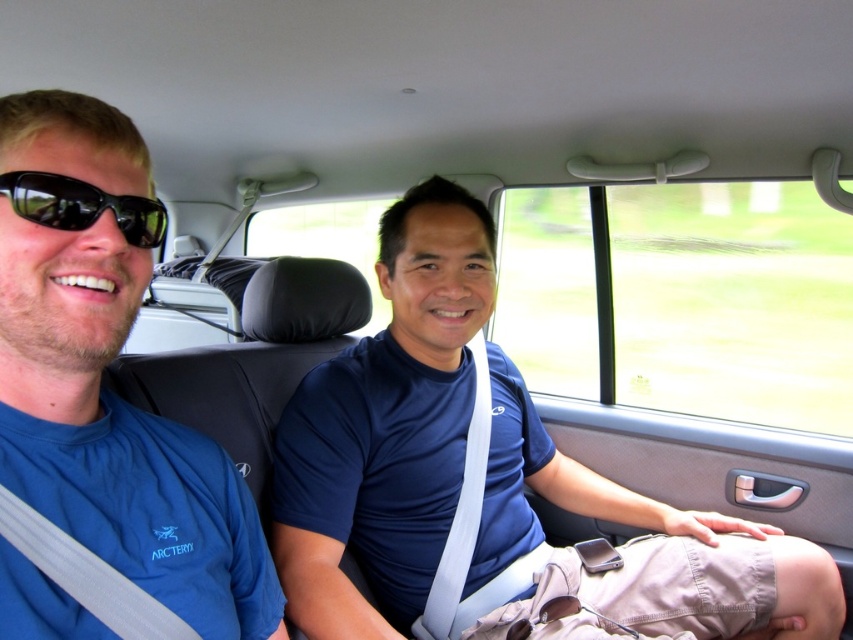
Which is in front, point (479, 628) or point (136, 224)?

Positioned in front is point (136, 224).

Between point (664, 557) and point (155, 225), which one is positioned behind?

Point (664, 557)

This screenshot has height=640, width=853. Find the location of `blue fabric shirt at center`. blue fabric shirt at center is located at coordinates (491, 484).

Is blue fabric shirt at left thinner than black plastic sunglasses at left?

Incorrect, blue fabric shirt at left's width is not less than black plastic sunglasses at left's.

In the scene shown: Can you confirm if blue fabric shirt at left is taller than black plastic sunglasses at left?

Yes, blue fabric shirt at left is taller than black plastic sunglasses at left.

Between point (91, 301) and point (135, 232), which one is positioned in front?

Point (91, 301) is in front.

The height and width of the screenshot is (640, 853). In order to click on blue fabric shirt at left in this screenshot , I will do `click(102, 374)`.

Does blue fabric shirt at center appear on the left side of blue fabric shirt at left?

In fact, blue fabric shirt at center is to the right of blue fabric shirt at left.

What do you see at coordinates (491, 484) in the screenshot? I see `blue fabric shirt at center` at bounding box center [491, 484].

Is point (486, 216) closer to viewer compared to point (142, 464)?

No, it is not.

Locate an element on the screen. The width and height of the screenshot is (853, 640). blue fabric shirt at center is located at coordinates (491, 484).